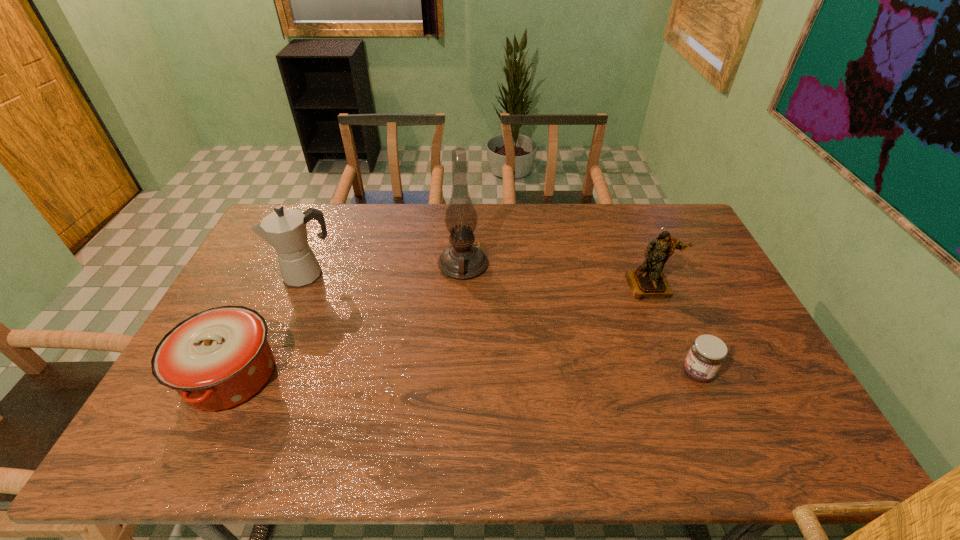
This screenshot has height=540, width=960. Find the location of `vacant space located on the front label of the jam`. vacant space located on the front label of the jam is located at coordinates (644, 373).

Locate an element on the screen. This screenshot has width=960, height=540. free location located 0.330m on the front label of the jam is located at coordinates (557, 373).

Image resolution: width=960 pixels, height=540 pixels. Identify the location of vacant position located 0.100m on the front label of the jam. (644, 373).

Find the location of a particular element. object situated at the near edge is located at coordinates (x=216, y=359).

This screenshot has height=540, width=960. I want to click on coffeepot that is positioned at the left edge, so click(x=284, y=229).

Find the location of a particular element. casserole that is at the left edge is located at coordinates (216, 359).

Where is `object at the near left corner`? object at the near left corner is located at coordinates (216, 359).

Where is `vacant space at the far edge`? The width and height of the screenshot is (960, 540). vacant space at the far edge is located at coordinates (582, 232).

In the image, there is a desktop. In order to click on free space at the near edge in this screenshot , I will do `click(522, 433)`.

At what (x,y) coordinates should I click in order to perform the action: click on vacant space at the left edge of the desktop. Please return your answer as a coordinate pair (x, y). This screenshot has height=540, width=960. Looking at the image, I should click on (260, 272).